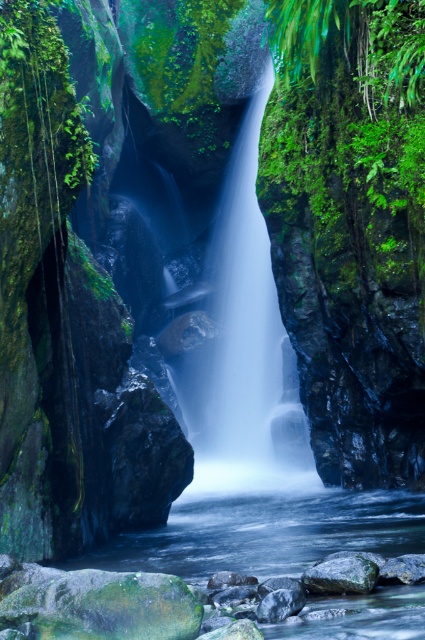
You are a hiker who wants to cross the waterfall area. You see the clear water at center and the green mossy rock at lower center. Which object is closer to you as you approach the waterfall?

The clear water at center is closer to you than the green mossy rock at lower center because it is in front of it.

You are standing at the bottom of the waterfall in the canyon. You see two points marked in the image. The first point is at coordinate point (x=360, y=595) and the second is at point (x=306, y=577). Which point is closer to you?

Point (x=360, y=595) is in front of point (x=306, y=577), so the first point is closer to you.